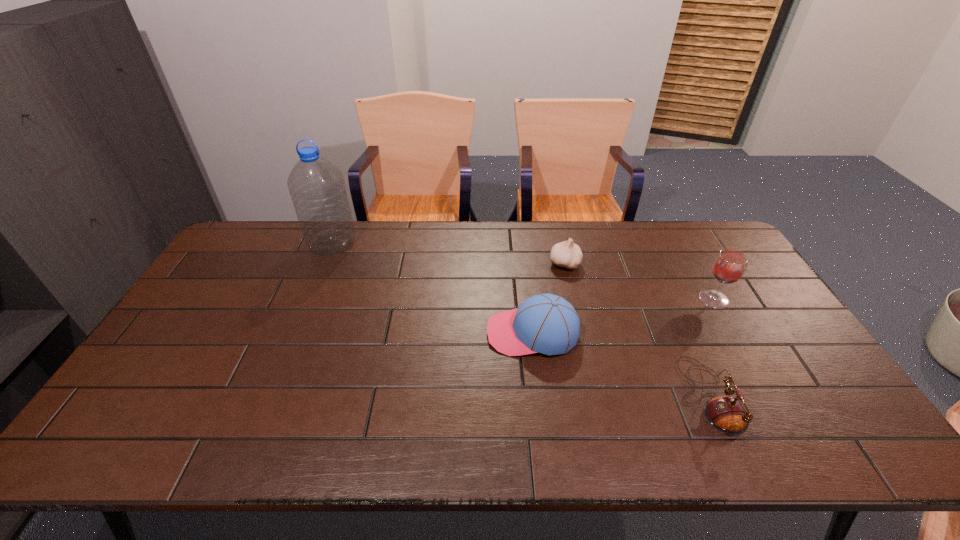
Find the location of a particular element. This screenshot has width=960, height=540. water jug is located at coordinates (317, 188).

Where is `the leftmost object`? This screenshot has width=960, height=540. the leftmost object is located at coordinates click(317, 188).

Image resolution: width=960 pixels, height=540 pixels. I want to click on the rightmost object, so click(729, 266).

Where is `wineglass`? This screenshot has width=960, height=540. wineglass is located at coordinates (729, 266).

The image size is (960, 540). What are the coordinates of `baseball cap` in the screenshot? It's located at (545, 323).

Locate an element on the screen. Image resolution: width=960 pixels, height=540 pixels. garlic is located at coordinates (566, 254).

Find the location of a particular element. Image resolution: width=960 pixels, height=540 pixels. telephone is located at coordinates (727, 414).

The height and width of the screenshot is (540, 960). What are the coordinates of `vacant space located on the right of the tallest object` in the screenshot? It's located at (421, 243).

Find the location of `free space located on the front of the rightmost object`. free space located on the front of the rightmost object is located at coordinates (730, 327).

Find the location of `free space located 0.050m on the front-facing side of the third tallest object`. free space located 0.050m on the front-facing side of the third tallest object is located at coordinates (469, 333).